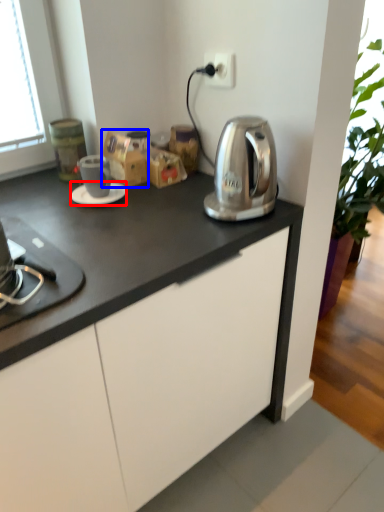
Question: Which object appears closest to the camera in this image, saucer (highlighted by a red box) or cardboard box (highlighted by a blue box)?

Choices:
 (A) saucer
 (B) cardboard box

Answer: (A)